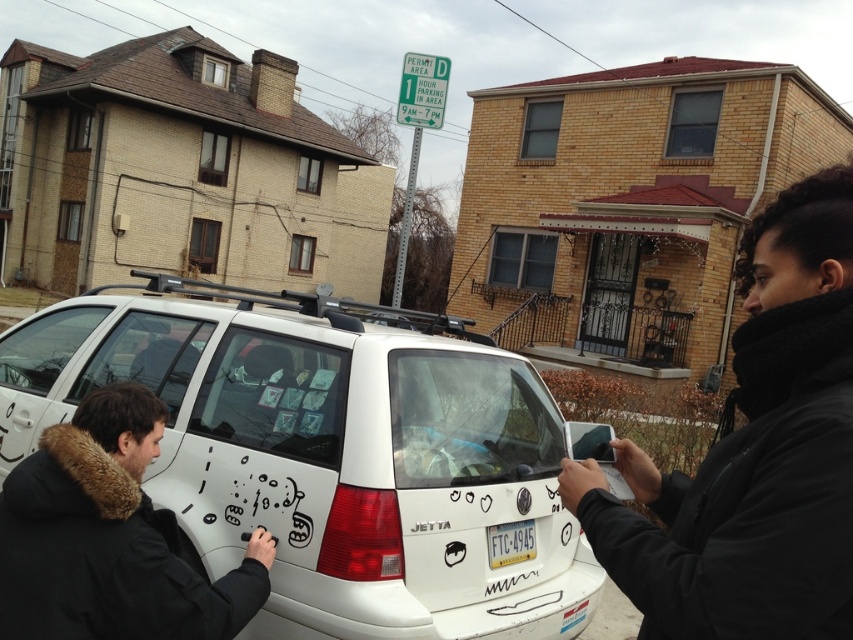
Question: Which object appears closest to the camera in this image?

Choices:
 (A) white plastic license plate at center
 (B) black fuzzy jacket at center
 (C) black fur coat at lower left

Answer: (B)

Question: Is the position of black fuzzy jacket at center more distant than that of white plastic license plate at center?

Choices:
 (A) no
 (B) yes

Answer: (A)

Question: Is black fur coat at lower left wider than white plastic license plate at center?

Choices:
 (A) no
 (B) yes

Answer: (B)

Question: Estimate the real-world distances between objects in this image. Which object is farther from the white plastic license plate at center?

Choices:
 (A) white matte suv at center
 (B) black fuzzy jacket at center

Answer: (A)

Question: Which point appears closest to the camera in this image?

Choices:
 (A) (762, 449)
 (B) (407, 419)
 (C) (115, 566)

Answer: (A)

Question: Does white matte suv at center appear on the left side of white plastic license plate at center?

Choices:
 (A) yes
 (B) no

Answer: (A)